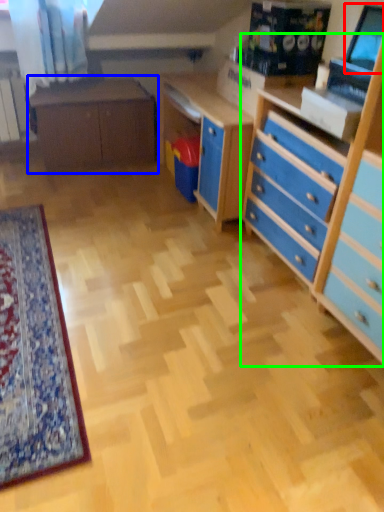
Question: Estimate the real-world distances between objects in this image. Which object is farther from computer monitor (highlighted by a red box), table (highlighted by a blue box) or chest of drawers (highlighted by a green box)?

Choices:
 (A) table
 (B) chest of drawers

Answer: (A)